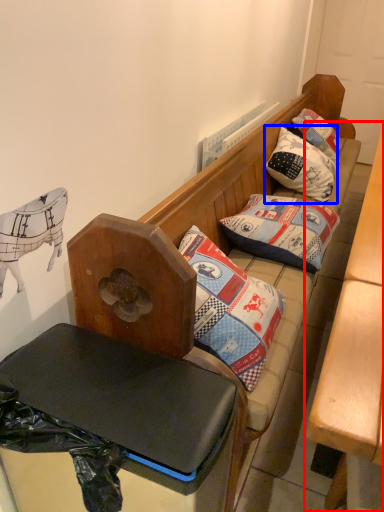
Question: Which object is closer to the camera taking this photo, table (highlighted by a red box) or pillow (highlighted by a blue box)?

Choices:
 (A) table
 (B) pillow

Answer: (A)